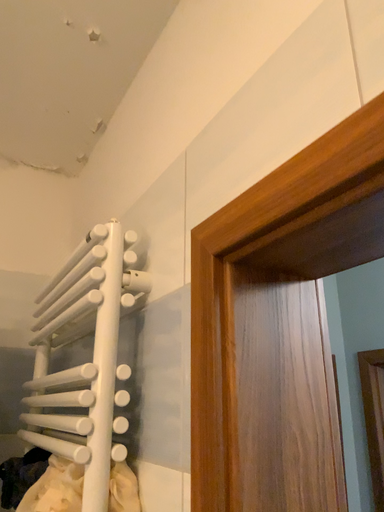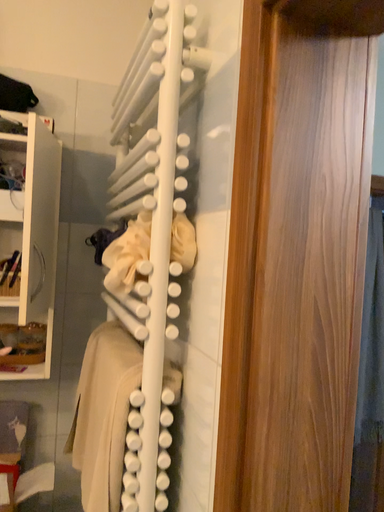
Question: How did the camera likely rotate when shooting the video?

Choices:
 (A) rotated left
 (B) rotated right

Answer: (A)